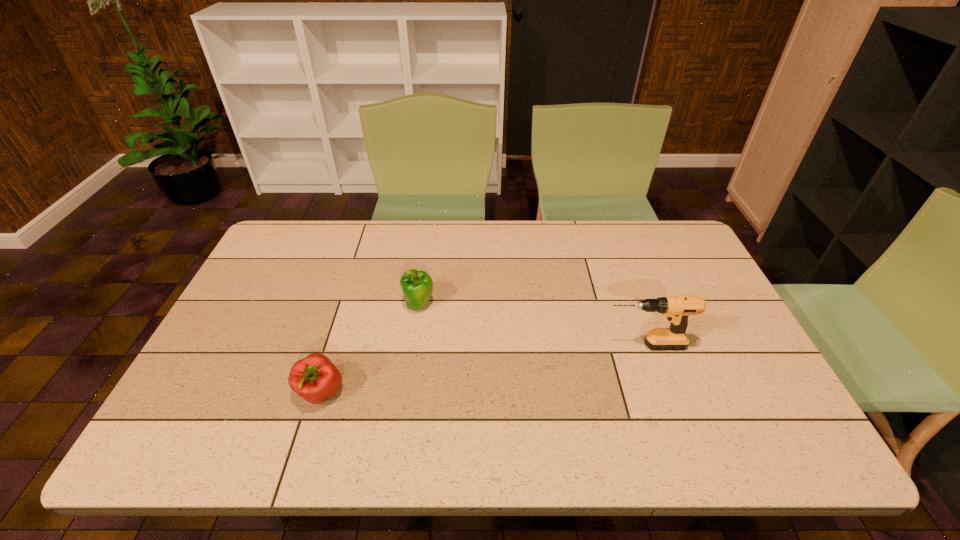
Where is `free space that satisfies the following two spatial constraints: 1. on the back side of the farther bell pepper; 2. on the left side of the nearest object`? free space that satisfies the following two spatial constraints: 1. on the back side of the farther bell pepper; 2. on the left side of the nearest object is located at coordinates (348, 305).